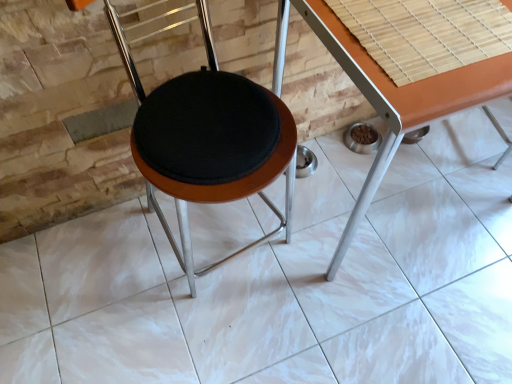
I want to click on empty space that is ontop of bamboo mat at upper right, so click(x=431, y=17).